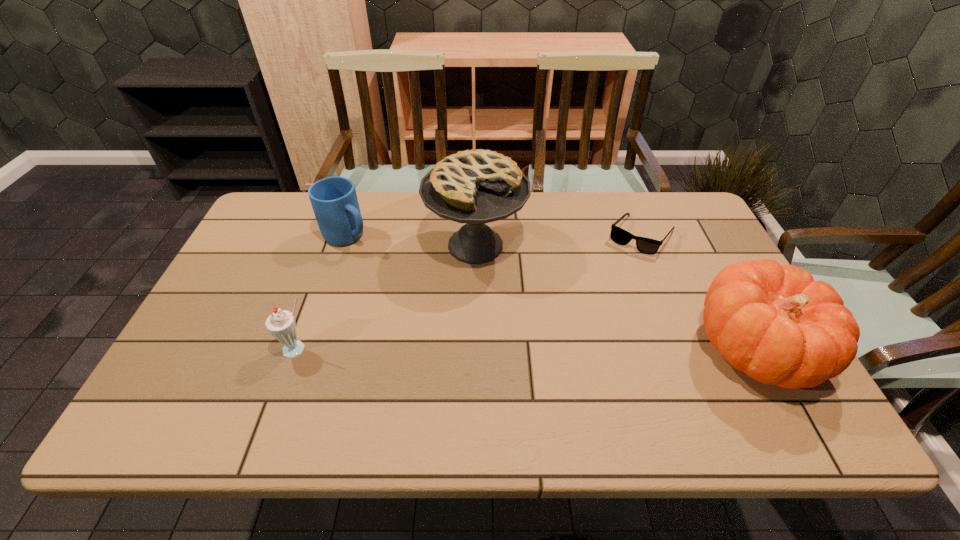
You are a GUI agent. You are given a task and a screenshot of the screen. Output one action in this format:
    pyautogui.click(x=<x>, y=<y>)
    Task: Click on the vacant space on the desktop that is between the milkshake and the fourth shortest object and is positioned on the cut side of the third object from right to left
    
    Given the screenshot: What is the action you would take?
    pyautogui.click(x=499, y=349)

Locate an element on the screen. The width and height of the screenshot is (960, 540). vacant spot on the desktop that is between the milkshake and the pumpkin and is positioned on the front-facing side of the shortest object is located at coordinates (574, 349).

Find the location of a particular element. The width and height of the screenshot is (960, 540). free spot on the desktop that is between the milkshake and the pumpkin and is positioned on the side of the mug with the handle is located at coordinates (512, 349).